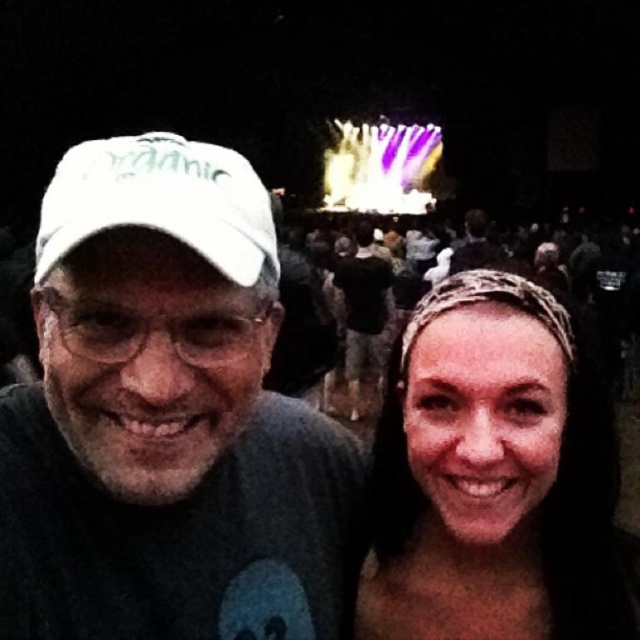
You are standing in the crowd at the concert and want to take a photo of both the white matte cap at upper left and the white fabric baseball cap at left. Which cap should you adjust your camera angle to focus on first to ensure both are in the frame?

The white matte cap at upper left is closer to the viewer than the white fabric baseball cap at left, so you should focus on the white fabric baseball cap at left first to ensure both are in the frame.

You are a photographer at the concert trying to capture a clear shot of the smooth skin headband at center. The stage lights are very bright. Where should you position your camera relative to the stage lights to avoid overexposure?

The smooth skin headband at center is located at point [493,474], so position your camera slightly to the side of the stage lights to avoid direct exposure and capture the headband clearly without overexposure.